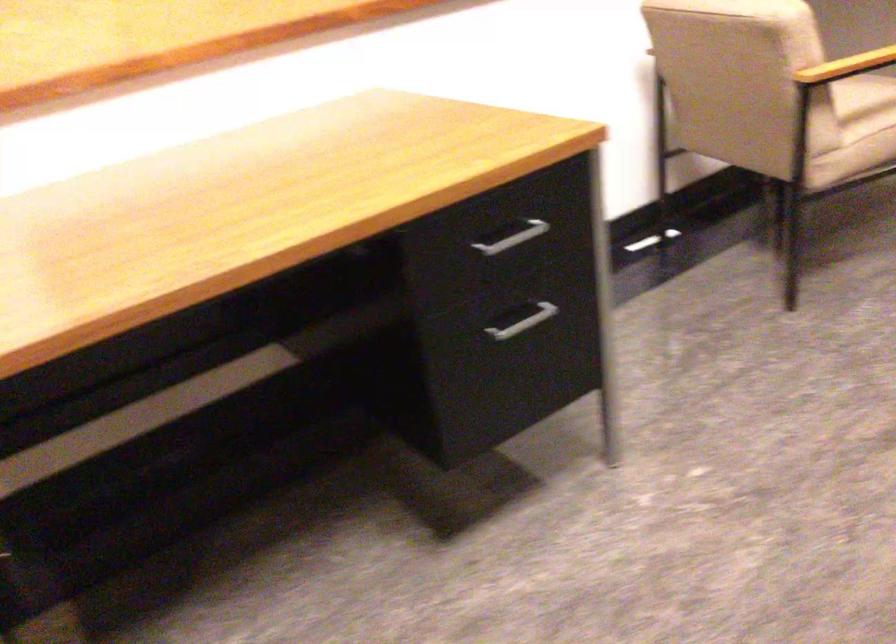
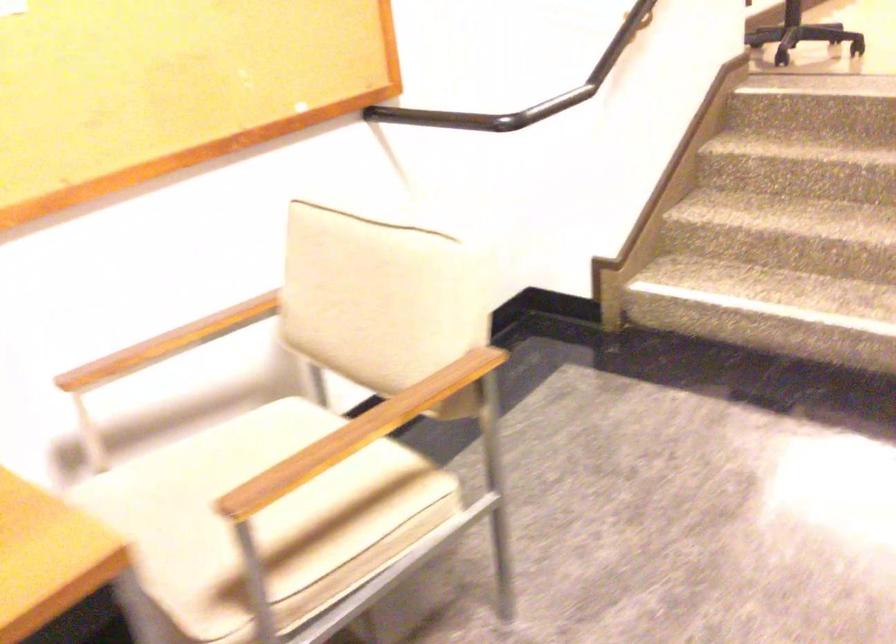
What movement of the cameraman would produce the second image?

The cameraman walked toward right, forward.